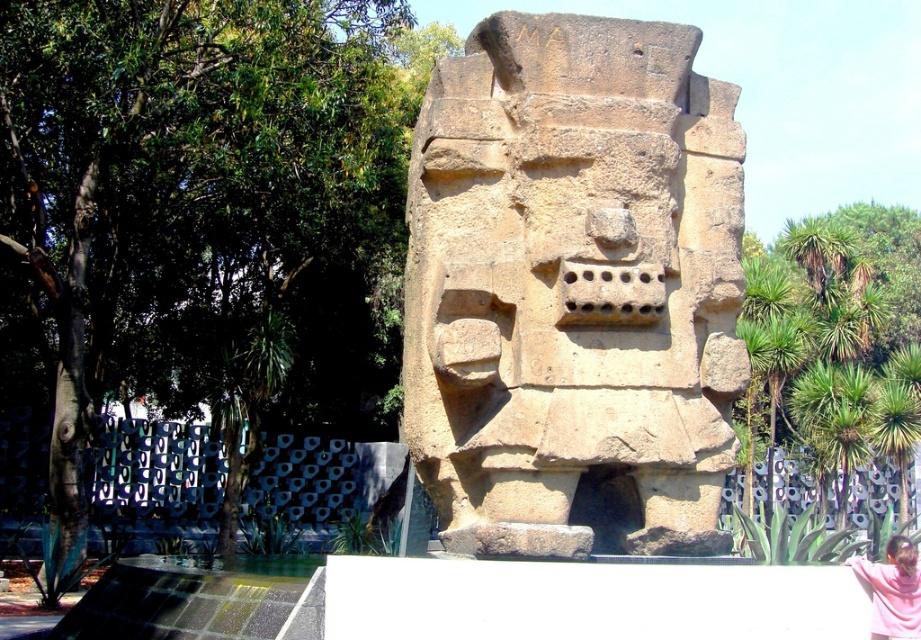
Who is more distant from viewer, (657, 419) or (895, 548)?

Positioned behind is point (895, 548).

Can you confirm if brown stone sculpture at center is positioned to the left of matte brown statue at center?

Yes, brown stone sculpture at center is to the left of matte brown statue at center.

What do you see at coordinates (573, 284) in the screenshot? The width and height of the screenshot is (921, 640). I see `brown stone sculpture at center` at bounding box center [573, 284].

Image resolution: width=921 pixels, height=640 pixels. I want to click on brown stone sculpture at center, so click(573, 284).

Is pink fabric at lower right positioned behind matte brown statue at center?

No, it is in front of matte brown statue at center.

Does pink fabric at lower right appear on the right side of matte brown statue at center?

No, pink fabric at lower right is not to the right of matte brown statue at center.

I want to click on pink fabric at lower right, so click(893, 589).

In the scene shown: Does brown stone sculpture at center appear on the left side of pink fabric at lower right?

Indeed, brown stone sculpture at center is positioned on the left side of pink fabric at lower right.

Consider the image. Is brown stone sculpture at center to the right of pink fabric at lower right from the viewer's perspective?

Incorrect, brown stone sculpture at center is not on the right side of pink fabric at lower right.

Locate an element on the screen. The height and width of the screenshot is (640, 921). brown stone sculpture at center is located at coordinates (573, 284).

In order to click on brown stone sculpture at center in this screenshot , I will do `click(573, 284)`.